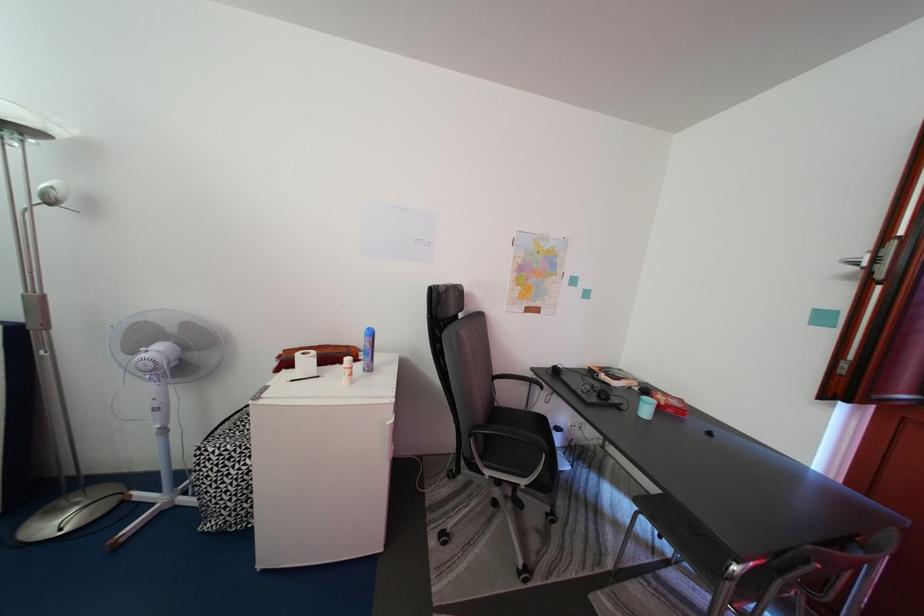
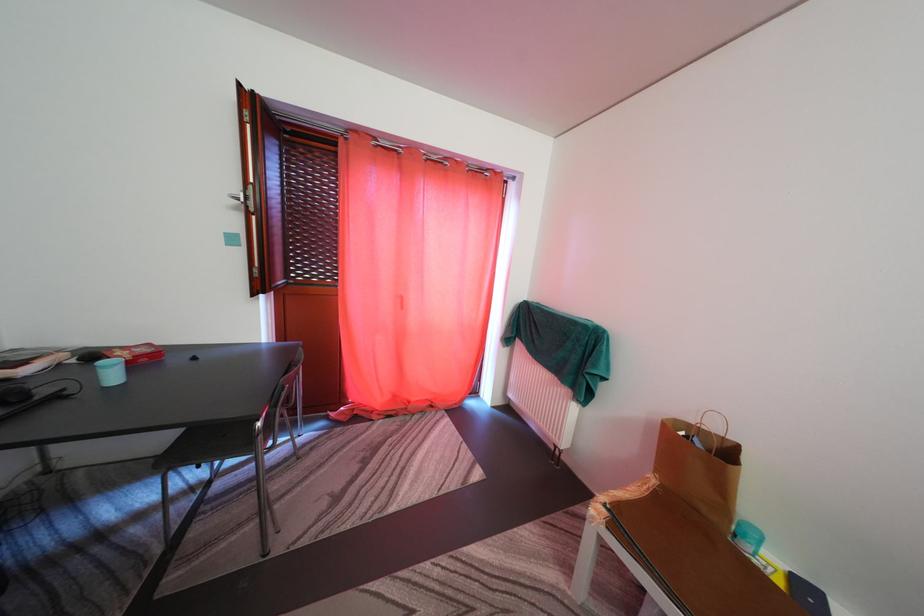
Where in the second image is the point corresponding to (x=745, y=576) from the first image?

(268, 431)